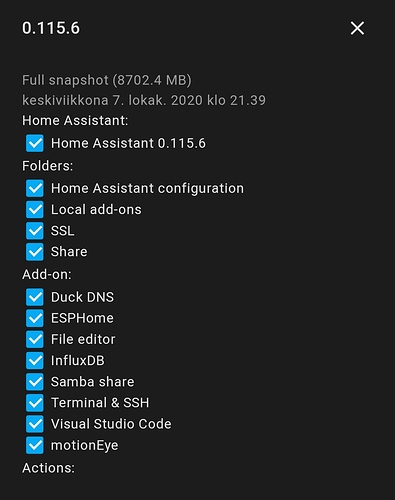
Locate an element on the screen. The height and width of the screenshot is (500, 395). folders is located at coordinates (40, 190), (40, 207), (39, 225), (37, 250).